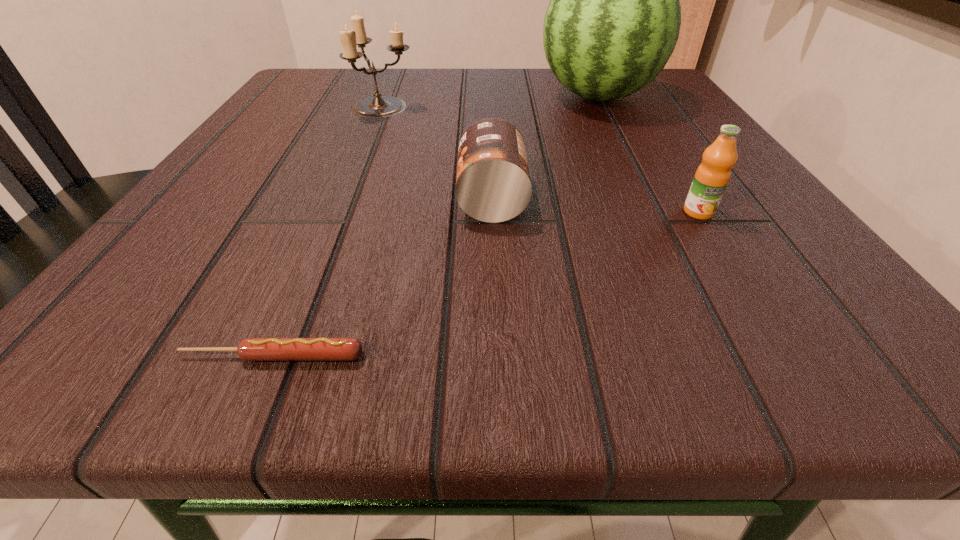
At what (x,y) coordinates should I click in order to perform the action: click on orange juice that is at the right edge. Please return your answer as a coordinate pair (x, y). The width and height of the screenshot is (960, 540). Looking at the image, I should click on (712, 176).

Identify the location of object that is at the far left corner. Image resolution: width=960 pixels, height=540 pixels. click(379, 106).

Locate an element on the screen. object situated at the near left corner is located at coordinates (250, 349).

You are a GUI agent. You are given a task and a screenshot of the screen. Output one action in this format:
    pyautogui.click(x=<x>, y=<y>)
    Task: Click on the object at the far right corner
    
    Given the screenshot: What is the action you would take?
    pyautogui.click(x=613, y=21)

Where is `free region at the far edge of the desktop`? free region at the far edge of the desktop is located at coordinates (425, 95).

At what (x,y) coordinates should I click in order to perform the action: click on vacant space at the near edge. Please return your answer as a coordinate pair (x, y). Looking at the image, I should click on (311, 333).

This screenshot has width=960, height=540. In the image, there is a desktop. In order to click on vacant space at the right edge in this screenshot , I will do `click(750, 281)`.

Identify the location of vacant space at the far left corner of the desktop. This screenshot has width=960, height=540. (326, 112).

Locate an element on the screen. This screenshot has width=960, height=540. vacant region at the near left corner is located at coordinates (142, 326).

Identify the location of vacant space at the near right corner of the desktop. (868, 323).